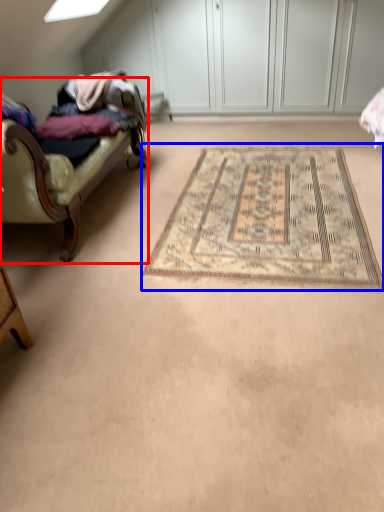
Question: Which point is further to the camera, studio couch (highlighted by a red box) or mat (highlighted by a blue box)?

Choices:
 (A) studio couch
 (B) mat

Answer: (B)